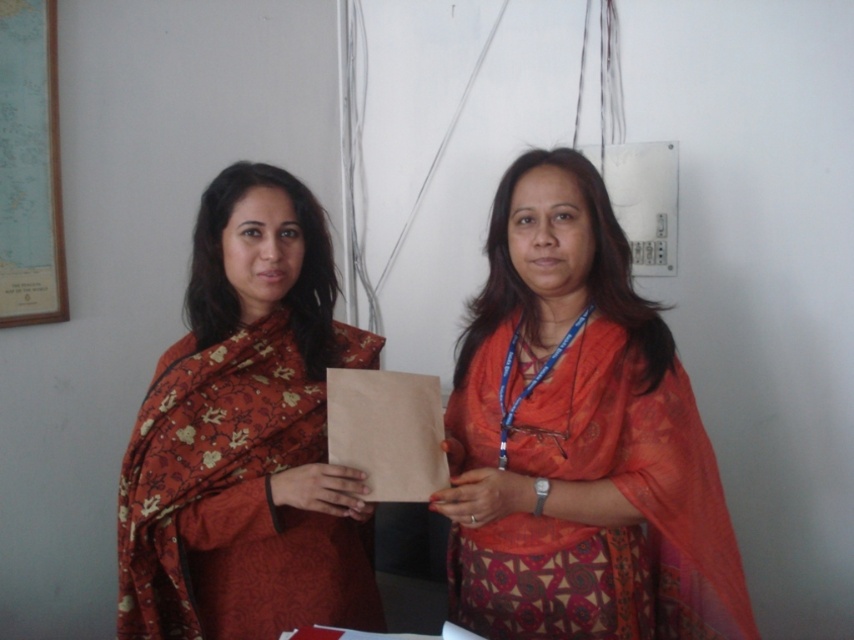
Question: Which point is closer to the camera?

Choices:
 (A) (635, 417)
 (B) (192, 618)

Answer: (A)

Question: Which point is farther to the camera?

Choices:
 (A) (190, 442)
 (B) (708, 634)

Answer: (B)

Question: Does matte orange sari at center appear under matte floral sari at center?

Choices:
 (A) no
 (B) yes

Answer: (B)

Question: Can you confirm if matte orange sari at center is bigger than matte floral sari at center?

Choices:
 (A) yes
 (B) no

Answer: (A)

Question: Is matte orange sari at center above matte floral sari at center?

Choices:
 (A) no
 (B) yes

Answer: (A)

Question: Which object appears closest to the camera in this image?

Choices:
 (A) matte orange sari at center
 (B) matte floral sari at center

Answer: (A)